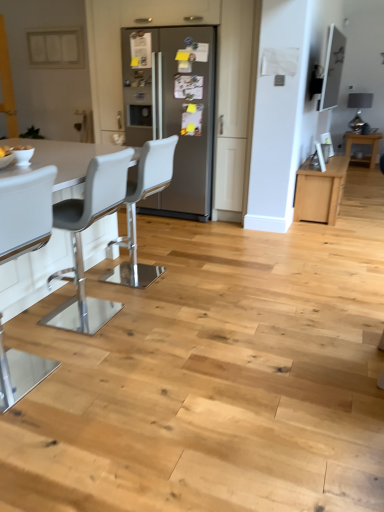
Question: From the image's perspective, is satin silver refrigerator at center positioned above or below white plastic chair at left, arranged as the 1th chair when viewed from the front?

Choices:
 (A) below
 (B) above

Answer: (B)

Question: Is satin silver refrigerator at center in front of or behind white plastic chair at left, positioned as the 3th chair in back-to-front order, in the image?

Choices:
 (A) behind
 (B) front

Answer: (A)

Question: Which object is the farthest from the satin silver refrigerator at center?

Choices:
 (A) white leather bar stool at left, the second chair viewed from the back
 (B) white plastic chair at left, arranged as the 1th chair when viewed from the front
 (C) light brown wood table at right
 (D) white plastic chair at center, marked as the first chair in a back-to-front arrangement

Answer: (C)

Question: Estimate the real-world distances between objects in this image. Which object is closer to the white plastic chair at center, positioned as the third chair in front-to-back order?

Choices:
 (A) light brown wood table at right
 (B) white plastic chair at left, arranged as the 1th chair when viewed from the front
 (C) white leather bar stool at left, which is the 2th chair from front to back
 (D) satin silver refrigerator at center

Answer: (C)